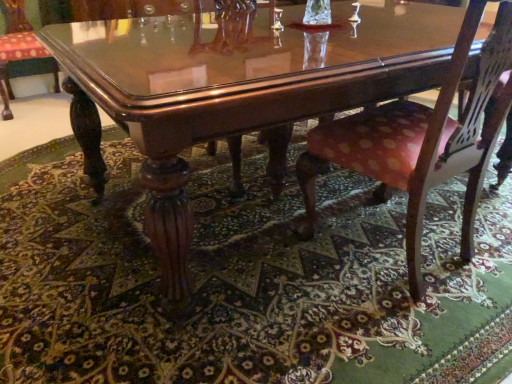
Describe the element at coordinates (16, 47) in the screenshot. I see `polished wood chair at lower left, placed as the second chair when sorted from right to left` at that location.

Find the location of a particular element. The image size is (512, 384). polished wood chair at lower left, the first chair from the left is located at coordinates (16, 47).

Is polished wood chair at lower left, the first chair from the left, turned away from glossy wood coffee table at center?

No, polished wood chair at lower left, the first chair from the left,'s orientation is not away from glossy wood coffee table at center.

Between polished wood chair at lower left, the first chair from the left, and glossy wood coffee table at center, which one has larger size?

With larger size is glossy wood coffee table at center.

Which object is wider, polished wood chair at lower left, placed as the 1th chair when sorted from top to bottom, or glossy wood coffee table at center?

With larger width is glossy wood coffee table at center.

How different are the orientations of polished wood chair at lower left, placed as the 1th chair when sorted from top to bottom, and glossy wood coffee table at center in degrees?

The angle between the facing direction of polished wood chair at lower left, placed as the 1th chair when sorted from top to bottom, and the facing direction of glossy wood coffee table at center is 179 degrees.

Where is `coffee table on the left of polka dot fabric chair at lower right, the second chair from the back`? Image resolution: width=512 pixels, height=384 pixels. coffee table on the left of polka dot fabric chair at lower right, the second chair from the back is located at coordinates (234, 90).

Which object is wider, polka dot fabric chair at lower right, marked as the 1th chair in a bottom-to-top arrangement, or glossy wood coffee table at center?

With larger width is glossy wood coffee table at center.

Is polka dot fabric chair at lower right, marked as the 1th chair in a bottom-to-top arrangement, smaller than glossy wood coffee table at center?

Indeed, polka dot fabric chair at lower right, marked as the 1th chair in a bottom-to-top arrangement, has a smaller size compared to glossy wood coffee table at center.

From the image's perspective, is polka dot fabric chair at lower right, the second chair from the back, located above or below glossy wood coffee table at center?

polka dot fabric chair at lower right, the second chair from the back, is situated lower than glossy wood coffee table at center in the image.

In the image, is polka dot fabric chair at lower right, the first chair positioned from the right, positioned in front of or behind polished wood chair at lower left, placed as the second chair when sorted from right to left?

A: polka dot fabric chair at lower right, the first chair positioned from the right, is in front of polished wood chair at lower left, placed as the second chair when sorted from right to left.

Considering the positions of point (482, 168) and point (11, 115), is point (482, 168) closer or farther from the camera than point (11, 115)?

Point (482, 168).

How much distance is there between polka dot fabric chair at lower right, which is the second chair in top-to-bottom order, and polished wood chair at lower left, the first chair in the back-to-front sequence?

polka dot fabric chair at lower right, which is the second chair in top-to-bottom order, and polished wood chair at lower left, the first chair in the back-to-front sequence, are 2.71 meters apart.

Is polka dot fabric chair at lower right, which is the second chair in top-to-bottom order, looking in the opposite direction of polished wood chair at lower left, the first chair from the left?

No, polka dot fabric chair at lower right, which is the second chair in top-to-bottom order,'s orientation is not away from polished wood chair at lower left, the first chair from the left.

How different are the orientations of glossy wood coffee table at center and polka dot fabric chair at lower right, the second chair from the back, in degrees?

4.14 degrees.

Is point (285, 93) positioned after point (329, 128)?

That is False.

Is glossy wood coffee table at center behind polka dot fabric chair at lower right, which is counted as the 1th chair, starting from the front?

No.

From the image's perspective, is glossy wood coffee table at center located beneath polka dot fabric chair at lower right, which is counted as the 1th chair, starting from the front?

Incorrect, from the image's perspective, glossy wood coffee table at center is higher than polka dot fabric chair at lower right, which is counted as the 1th chair, starting from the front.

Which is farther from the camera, (17, 34) or (404, 349)?

Positioned behind is point (17, 34).

From the image's perspective, relative to green patterned rug at lower center, is polished wood chair at lower left, the 2th chair in the bottom-to-top sequence, above or below?

polished wood chair at lower left, the 2th chair in the bottom-to-top sequence, is above green patterned rug at lower center.

What's the angular difference between polished wood chair at lower left, the 2th chair in the bottom-to-top sequence, and green patterned rug at lower center's facing directions?

The facing directions of polished wood chair at lower left, the 2th chair in the bottom-to-top sequence, and green patterned rug at lower center are 178 degrees apart.

Is polished wood chair at lower left, the 2th chair in the bottom-to-top sequence, beside green patterned rug at lower center?

No, polished wood chair at lower left, the 2th chair in the bottom-to-top sequence, is not beside green patterned rug at lower center.

Does green patterned rug at lower center turn towards polished wood chair at lower left, the first chair from the left?

No, green patterned rug at lower center does not turn towards polished wood chair at lower left, the first chair from the left.

Is polished wood chair at lower left, the 2th chair in the bottom-to-top sequence, located within green patterned rug at lower center?

No, polished wood chair at lower left, the 2th chair in the bottom-to-top sequence, is located outside of green patterned rug at lower center.

In the image, is green patterned rug at lower center on the left side or the right side of polished wood chair at lower left, the first chair from the left?

green patterned rug at lower center is positioned on polished wood chair at lower left, the first chair from the left,'s right side.

From the picture: From the image's perspective, between green patterned rug at lower center and polished wood chair at lower left, which ranks as the second chair in front-to-back order, which one is located above?

From the image's view, polished wood chair at lower left, which ranks as the second chair in front-to-back order, is above.

Is glossy wood coffee table at center far from green patterned rug at lower center?

No, glossy wood coffee table at center is not far from green patterned rug at lower center.

Which object is positioned more to the left, glossy wood coffee table at center or green patterned rug at lower center?

green patterned rug at lower center is more to the left.

From the image's perspective, is glossy wood coffee table at center below green patterned rug at lower center?

No.

How many degrees apart are the facing directions of glossy wood coffee table at center and green patterned rug at lower center?

The angular difference between glossy wood coffee table at center and green patterned rug at lower center is 1.02 degrees.

Where is `coffee table above the polished wood chair at lower left, the 2th chair in the bottom-to-top sequence (from a real-world perspective)`? Image resolution: width=512 pixels, height=384 pixels. coffee table above the polished wood chair at lower left, the 2th chair in the bottom-to-top sequence (from a real-world perspective) is located at coordinates point(234,90).

Find the location of a particular element. The height and width of the screenshot is (384, 512). coffee table located underneath the polka dot fabric chair at lower right, marked as the 1th chair in a bottom-to-top arrangement (from a real-world perspective) is located at coordinates (234, 90).

Which object lies further to the anchor point green patterned rug at lower center, polka dot fabric chair at lower right, which is counted as the 1th chair, starting from the front, or glossy wood coffee table at center?

The object further to green patterned rug at lower center is glossy wood coffee table at center.

Estimate the real-world distances between objects in this image. Which object is closer to green patterned rug at lower center, polka dot fabric chair at lower right, which is the second chair in top-to-bottom order, or polished wood chair at lower left, the first chair from the left?

polka dot fabric chair at lower right, which is the second chair in top-to-bottom order, lies closer to green patterned rug at lower center than the other object.

Based on their spatial positions, is green patterned rug at lower center or polka dot fabric chair at lower right, which is the second chair in top-to-bottom order, further from glossy wood coffee table at center?

The object further to glossy wood coffee table at center is green patterned rug at lower center.

In the scene shown: From the image, which object appears to be nearer to green patterned rug at lower center, glossy wood coffee table at center or polka dot fabric chair at lower right, marked as the 1th chair in a bottom-to-top arrangement?

polka dot fabric chair at lower right, marked as the 1th chair in a bottom-to-top arrangement, is positioned closer to the anchor green patterned rug at lower center.

Which object lies nearer to the anchor point polished wood chair at lower left, the first chair in the back-to-front sequence, polka dot fabric chair at lower right, the first chair positioned from the right, or glossy wood coffee table at center?

The object closer to polished wood chair at lower left, the first chair in the back-to-front sequence, is glossy wood coffee table at center.

Considering their positions, is polished wood chair at lower left, which ranks as the second chair in front-to-back order, positioned further to green patterned rug at lower center than polka dot fabric chair at lower right, which is the second chair in top-to-bottom order?

polished wood chair at lower left, which ranks as the second chair in front-to-back order.

Based on their spatial positions, is glossy wood coffee table at center or polished wood chair at lower left, the 2th chair in the bottom-to-top sequence, further from green patterned rug at lower center?

polished wood chair at lower left, the 2th chair in the bottom-to-top sequence.

Estimate the real-world distances between objects in this image. Which object is further from glossy wood coffee table at center, polka dot fabric chair at lower right, the second chair from the back, or polished wood chair at lower left, placed as the 1th chair when sorted from top to bottom?

polished wood chair at lower left, placed as the 1th chair when sorted from top to bottom, is further to glossy wood coffee table at center.

Where is `place mat between polished wood chair at lower left, the first chair from the left, and polka dot fabric chair at lower right, marked as the 1th chair in a bottom-to-top arrangement, in the horizontal direction`? This screenshot has width=512, height=384. place mat between polished wood chair at lower left, the first chair from the left, and polka dot fabric chair at lower right, marked as the 1th chair in a bottom-to-top arrangement, in the horizontal direction is located at coordinates (241, 283).

Locate an element on the screen. This screenshot has height=384, width=512. coffee table situated between green patterned rug at lower center and polka dot fabric chair at lower right, which is the 2th chair in left-to-right order, from left to right is located at coordinates (234, 90).

Find the location of a particular element. The image size is (512, 384). coffee table between polished wood chair at lower left, the first chair from the left, and polka dot fabric chair at lower right, which is the 2th chair in left-to-right order, in the horizontal direction is located at coordinates (234, 90).

Where is `coffee table between green patterned rug at lower center and polished wood chair at lower left, which ranks as the second chair in front-to-back order, from front to back`? coffee table between green patterned rug at lower center and polished wood chair at lower left, which ranks as the second chair in front-to-back order, from front to back is located at coordinates (234, 90).